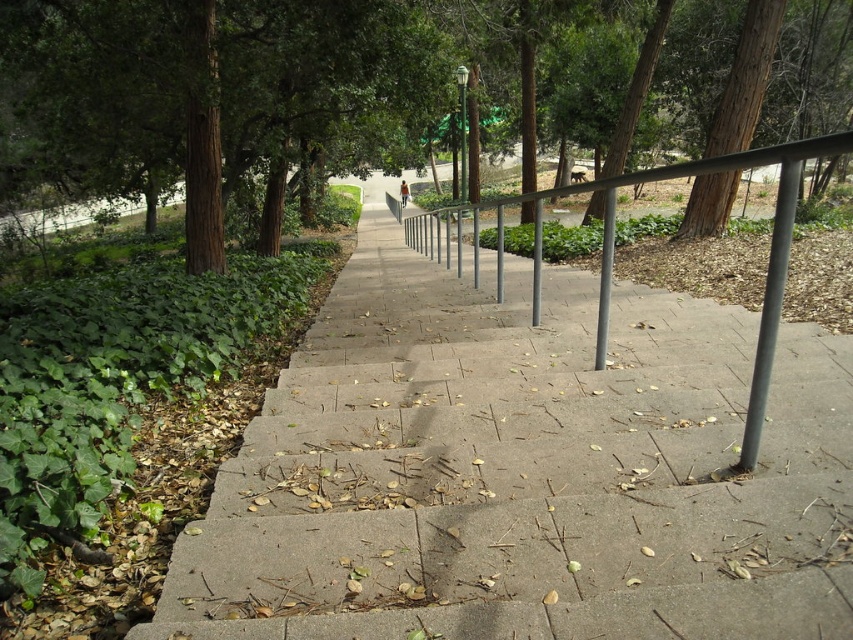
Question: Which point appears farthest from the camera in this image?

Choices:
 (A) (734, 525)
 (B) (752, 444)

Answer: (B)

Question: Based on their relative distances, which object is nearer to the brown textured tree at upper left?

Choices:
 (A) metallic gray balustrade at center
 (B) gray metallic pole at right

Answer: (A)

Question: Does metallic gray balustrade at center appear on the left side of gray metallic pole at right?

Choices:
 (A) yes
 (B) no

Answer: (A)

Question: Which point is closer to the camera?

Choices:
 (A) brown textured tree at upper left
 (B) gray metallic pole at right
 (C) metallic gray balustrade at center

Answer: (C)

Question: Is concrete at center to the right of metallic gray balustrade at center from the viewer's perspective?

Choices:
 (A) no
 (B) yes

Answer: (A)

Question: Considering the relative positions of brown textured tree at upper left and metallic gray balustrade at center in the image provided, where is brown textured tree at upper left located with respect to metallic gray balustrade at center?

Choices:
 (A) below
 (B) above

Answer: (B)